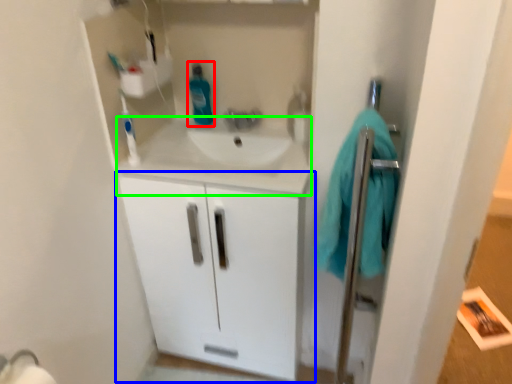
Question: Which is nearer to the cleaning product (highlighted by a red box)? bathroom cabinet (highlighted by a blue box) or counter top (highlighted by a green box).

Choices:
 (A) bathroom cabinet
 (B) counter top

Answer: (B)